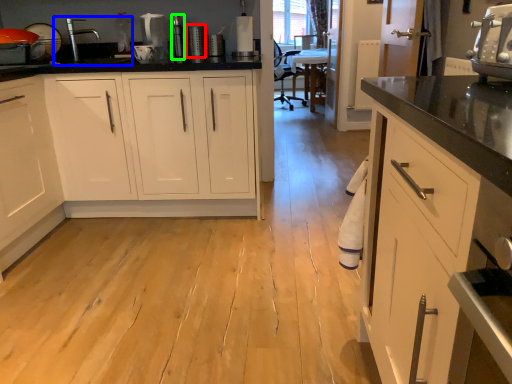
Question: Which object is positioned farthest from appliance (highlighted by a red box)? Select from sink (highlighted by a blue box) and appliance (highlighted by a green box).

Choices:
 (A) sink
 (B) appliance

Answer: (A)